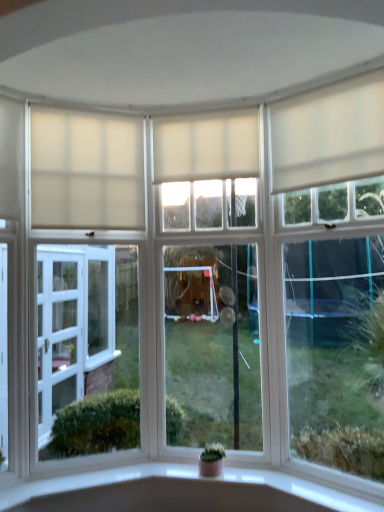
You are a GUI agent. You are given a task and a screenshot of the screen. Output one action in this format:
    pyautogui.click(x=<x>, y=<y>)
    Task: Click on the empty space that is ontop of white matte curtain at upper center, which is the first curtain from left to right
    This screenshot has height=512, width=384.
    Given the screenshot: What is the action you would take?
    pyautogui.click(x=97, y=112)